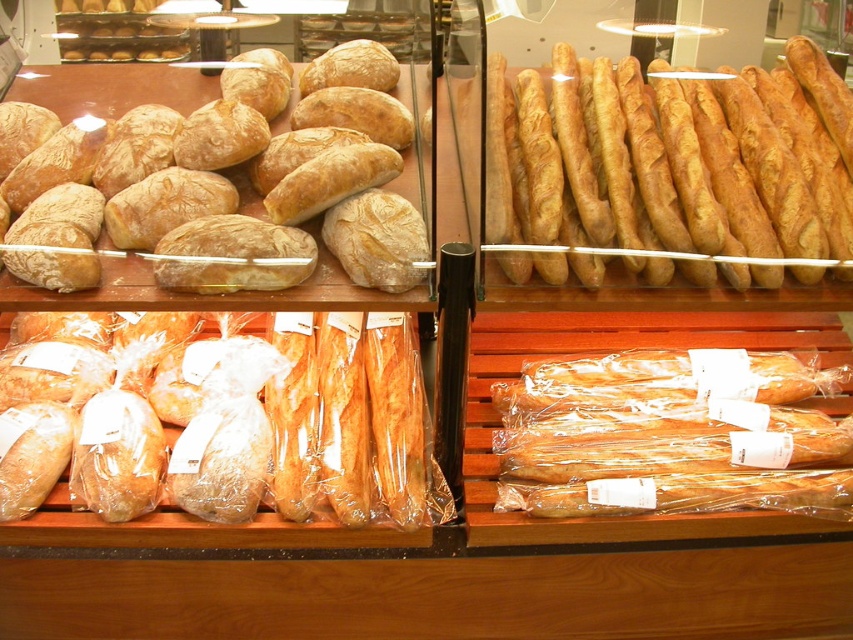
Is golden crispy baguette at upper right above golden crispy baguette at lower right?

Correct, golden crispy baguette at upper right is located above golden crispy baguette at lower right.

Is golden crispy baguette at upper right in front of golden crispy baguette at lower right?

Yes, golden crispy baguette at upper right is in front of golden crispy baguette at lower right.

Which is in front, point (490, 128) or point (757, 392)?

Point (490, 128) is more forward.

Identify the location of golden crispy baguette at upper right. (665, 172).

Does golden brown baguette at lower left appear on the right side of matte brown loaf at upper left?

No, golden brown baguette at lower left is not to the right of matte brown loaf at upper left.

Is point (399, 324) closer to viewer compared to point (405, 288)?

That is False.

Does point (109, 432) come farther from viewer compared to point (341, 182)?

Yes, it is behind point (341, 182).

I want to click on golden brown baguette at lower left, so click(236, 412).

In the scene shown: Measure the distance from golden crispy baguette at lower right to matte brown loaf at upper left.

golden crispy baguette at lower right is 23.84 inches from matte brown loaf at upper left.

Is golden crispy baguette at lower right closer to camera compared to matte brown loaf at upper left?

No, golden crispy baguette at lower right is further to the viewer.

The height and width of the screenshot is (640, 853). Find the location of `golden crispy baguette at lower right`. golden crispy baguette at lower right is located at coordinates (670, 435).

You are a GUI agent. You are given a task and a screenshot of the screen. Output one action in this format:
    pyautogui.click(x=<x>, y=<y>)
    Task: Click on the golden crispy baguette at lower right
    The height and width of the screenshot is (640, 853).
    Given the screenshot: What is the action you would take?
    pyautogui.click(x=670, y=435)